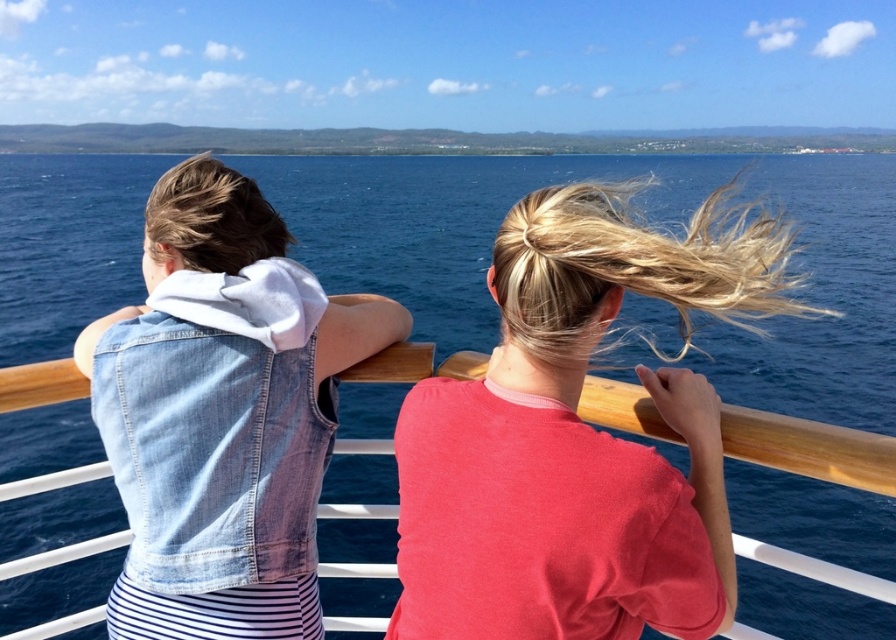
Question: Is blonde silky hair at upper right in front of blonde silky hair at upper left?

Choices:
 (A) yes
 (B) no

Answer: (A)

Question: Which object appears farthest from the camera in this image?

Choices:
 (A) blonde silky hair at upper right
 (B) blonde silky hair at upper left

Answer: (B)

Question: Considering the real-world distances, which object is closest to the blonde silky hair at upper right?

Choices:
 (A) denim vest at left
 (B) blonde silky hair at upper left

Answer: (A)

Question: Does denim vest at left have a greater width compared to blonde silky hair at upper right?

Choices:
 (A) yes
 (B) no

Answer: (B)

Question: Considering the relative positions of denim vest at left and blonde silky hair at upper right in the image provided, where is denim vest at left located with respect to blonde silky hair at upper right?

Choices:
 (A) below
 (B) above

Answer: (A)

Question: Which object appears closest to the camera in this image?

Choices:
 (A) blonde silky hair at upper left
 (B) blonde silky hair at upper right

Answer: (B)